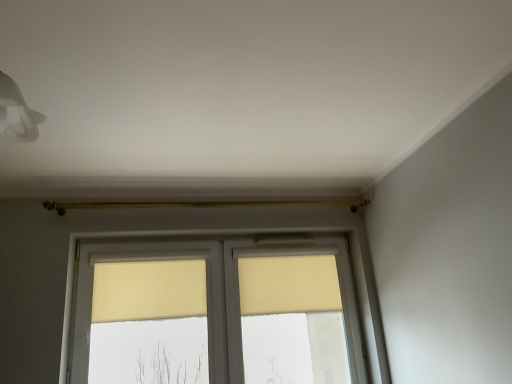
Question: Considering the relative sizes of matte yellow window at center and beige fabric curtain at center, the first curtain when ordered from right to left, in the image provided, is matte yellow window at center thinner than beige fabric curtain at center, the first curtain when ordered from right to left,?

Choices:
 (A) yes
 (B) no

Answer: (B)

Question: From the image's perspective, is matte yellow window at center beneath beige fabric curtain at center, the second curtain from the left?

Choices:
 (A) yes
 (B) no

Answer: (A)

Question: Are matte yellow window at center and beige fabric curtain at center, the first curtain when ordered from right to left, far apart?

Choices:
 (A) no
 (B) yes

Answer: (A)

Question: Can you confirm if matte yellow window at center is taller than beige fabric curtain at center, the first curtain when ordered from right to left?

Choices:
 (A) yes
 (B) no

Answer: (A)

Question: Considering the relative positions of matte yellow window at center and beige fabric curtain at center, the second curtain from the left, in the image provided, is matte yellow window at center to the left of beige fabric curtain at center, the second curtain from the left, from the viewer's perspective?

Choices:
 (A) no
 (B) yes

Answer: (B)

Question: In the image, is matte yellow window at center positioned in front of or behind beige fabric curtain at center, the first curtain when ordered from left to right?

Choices:
 (A) behind
 (B) front

Answer: (B)

Question: From a real-world perspective, relative to beige fabric curtain at center, acting as the 2th curtain starting from the right, is matte yellow window at center vertically above or below?

Choices:
 (A) above
 (B) below

Answer: (B)

Question: Is matte yellow window at center taller or shorter than beige fabric curtain at center, acting as the 2th curtain starting from the right?

Choices:
 (A) tall
 (B) short

Answer: (A)

Question: Which is correct: matte yellow window at center is inside beige fabric curtain at center, acting as the 2th curtain starting from the right, or outside of it?

Choices:
 (A) outside
 (B) inside

Answer: (A)

Question: In terms of height, does matte yellow window at center look taller or shorter compared to beige fabric curtain at center, the second curtain from the left?

Choices:
 (A) tall
 (B) short

Answer: (A)

Question: Would you say matte yellow window at center is inside or outside beige fabric curtain at center, the second curtain from the left?

Choices:
 (A) inside
 (B) outside

Answer: (B)

Question: From a real-world perspective, relative to beige fabric curtain at center, the second curtain from the left, is matte yellow window at center vertically above or below?

Choices:
 (A) below
 (B) above

Answer: (A)

Question: Relative to beige fabric curtain at center, the second curtain from the left, is matte yellow window at center in front or behind?

Choices:
 (A) behind
 (B) front

Answer: (B)

Question: In the image, is beige fabric curtain at center, the second curtain from the left, on the left side or the right side of beige fabric curtain at center, the first curtain when ordered from left to right?

Choices:
 (A) right
 (B) left

Answer: (A)

Question: From a real-world perspective, is beige fabric curtain at center, the second curtain from the left, positioned above or below beige fabric curtain at center, acting as the 2th curtain starting from the right?

Choices:
 (A) below
 (B) above

Answer: (A)